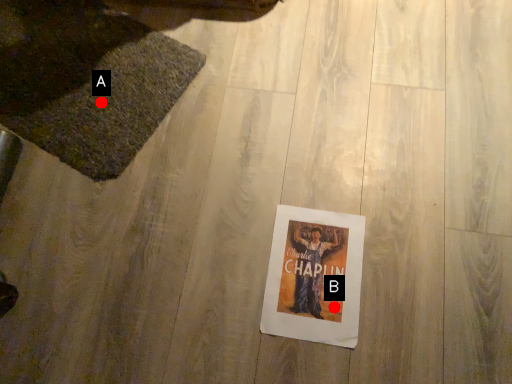
Question: Two points are circled on the image, labeled by A and B beside each circle. Which point is closer to the camera?

Choices:
 (A) A is closer
 (B) B is closer

Answer: (B)